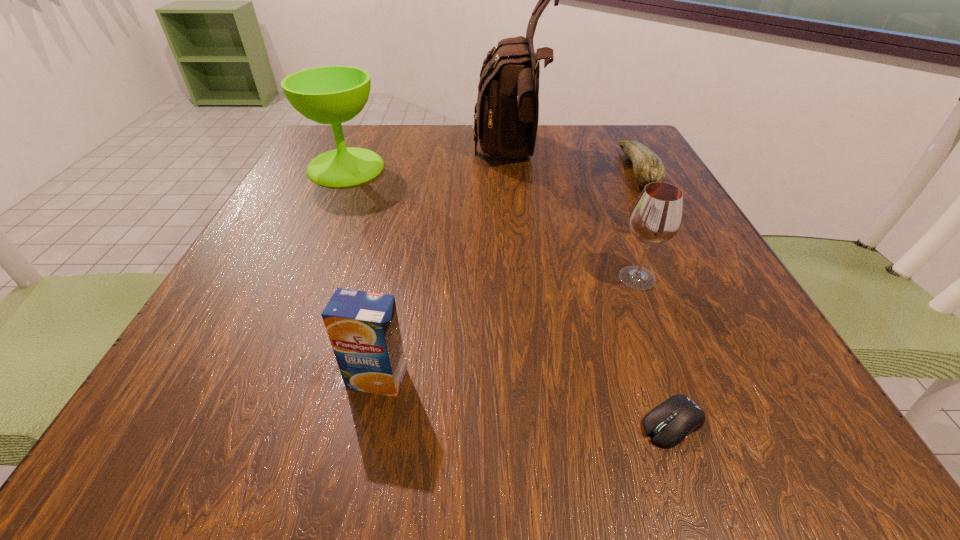
The image size is (960, 540). What are the coordinates of `vacant area situated 0.340m at the stem end of the rightmost object` in the screenshot? It's located at (470, 171).

Locate an element on the screen. The height and width of the screenshot is (540, 960). free space located on the right of the computer equipment is located at coordinates (756, 423).

At what (x,y) coordinates should I click in order to perform the action: click on shoulder bag positioned at the far edge. Please return your answer as a coordinate pair (x, y). The image size is (960, 540). Looking at the image, I should click on (506, 120).

This screenshot has width=960, height=540. Find the location of `wineglass that is at the far edge`. wineglass that is at the far edge is located at coordinates (333, 95).

Where is `zucchini present at the far edge`? The image size is (960, 540). zucchini present at the far edge is located at coordinates (647, 166).

The image size is (960, 540). What are the coordinates of `orange_juice present at the near edge` in the screenshot? It's located at (363, 328).

Find the location of a particular element. This screenshot has width=960, height=540. computer equipment present at the near edge is located at coordinates (669, 423).

Find the location of a particular element. object at the left edge is located at coordinates (333, 95).

You are a GUI agent. You are given a task and a screenshot of the screen. Output one action in this format:
    pyautogui.click(x=<x>, y=<y>)
    Task: Click on the wineglass located in the right edge section of the desktop
    The width and height of the screenshot is (960, 540).
    Given the screenshot: What is the action you would take?
    pyautogui.click(x=656, y=217)

What are the coordinates of `zucchini situated at the right edge` in the screenshot? It's located at (647, 166).